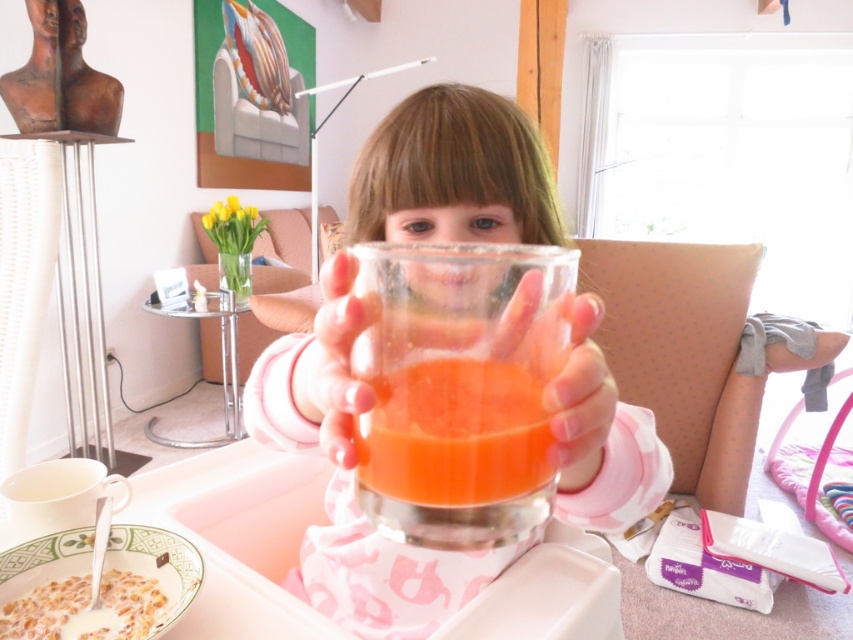
Does transparent glass cup at center have a larger size compared to translucent glass cup at center?

Yes.

Measure the distance between point (334, 422) and camera.

Point (334, 422) is 13.80 inches away from camera.

Find the location of a particular element. This screenshot has height=640, width=853. transparent glass cup at center is located at coordinates click(x=347, y=476).

Does point (376, 468) come in front of point (53, 589)?

Yes, point (376, 468) is closer to viewer.

What do you see at coordinates (456, 429) in the screenshot? I see `translucent glass juice at center` at bounding box center [456, 429].

Find the location of a particular element. Image resolution: width=853 pixels, height=640 pixels. translucent glass juice at center is located at coordinates (456, 429).

Is point (532, 356) positioned behind point (405, 461)?

No, (532, 356) is closer to viewer.

Can you confirm if translucent glass cup at center is positioned to the left of translucent glass juice at center?

No, translucent glass cup at center is not to the left of translucent glass juice at center.

Is point (364, 461) positioned behind point (537, 400)?

Yes, it is.

The width and height of the screenshot is (853, 640). I want to click on translucent glass cup at center, so click(459, 388).